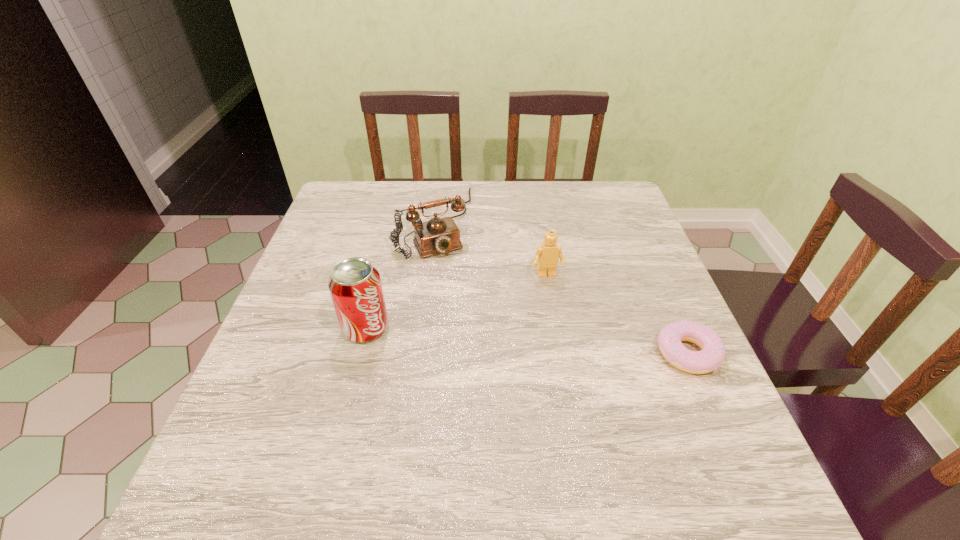
You are a GUI agent. You are given a task and a screenshot of the screen. Output one action in this format:
    pyautogui.click(x=<x>, y=<y>)
    Task: Click on the free space on the desktop that is between the soda can and the doughnut and is positioned on the dial of the telephone
    
    Given the screenshot: What is the action you would take?
    pyautogui.click(x=499, y=339)

Identify the location of vacant spot on the desktop that is between the soda can and the shortest object and is positioned on the face of the Lego. 569,344.